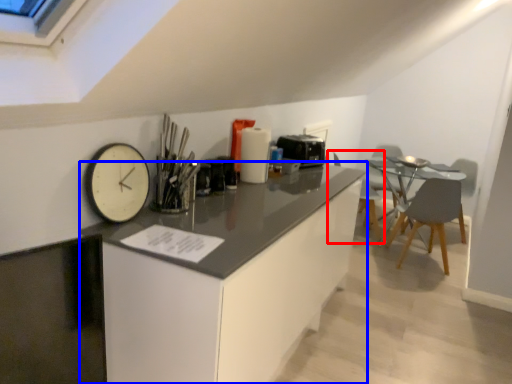
Question: Which of the following is the farthest to the observer, chair (highlighted by a red box) or cabinetry (highlighted by a blue box)?

Choices:
 (A) chair
 (B) cabinetry

Answer: (A)